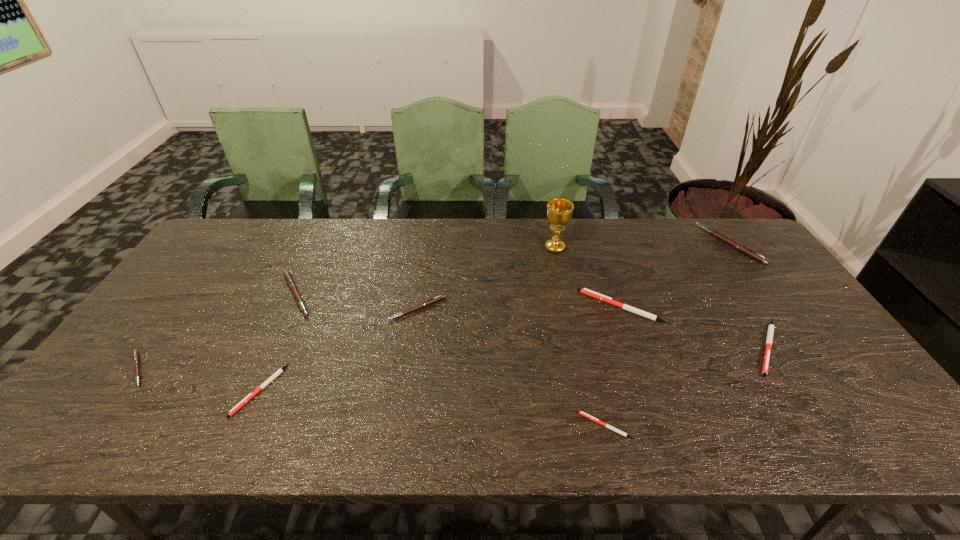
In order to click on vacant space that is in between the farthest pen and the smallest white pen in this screenshot , I will do `click(667, 335)`.

In order to click on unoccupied area between the smallest white pen and the chalice in this screenshot , I will do `click(580, 337)`.

The image size is (960, 540). Identify the location of blank region between the third smallest pink pen and the rightmost pink pen. (513, 270).

In order to click on empty space between the second smallest white pen and the second pink pen from left to right in this screenshot , I will do `click(278, 342)`.

Find the location of a particular element. blank region between the second biggest white pen and the smallest pink pen is located at coordinates (452, 359).

I want to click on free space between the third pink pen from right to left and the third biggest white pen, so click(278, 342).

Where is `vacant area between the third pink pen from left to right and the rightmost white pen`? The height and width of the screenshot is (540, 960). vacant area between the third pink pen from left to right and the rightmost white pen is located at coordinates (592, 328).

At what (x,y) coordinates should I click in order to perform the action: click on vacant space in between the third pink pen from right to left and the shortest pen. Please return your answer as a coordinate pair (x, y). Looking at the image, I should click on (450, 360).

Select which object is the seventh closest to the third smallest pink pen. Please provide its 2D coordinates. Your answer should be formatted as a tuple, i.e. [(x, y)], where the tuple contains the x and y coordinates of a point satisfying the conditions above.

[(771, 327)]

Point out which object is positioned as the fourth nearest to the third biggest white pen. Please provide its 2D coordinates. Your answer should be formatted as a tuple, i.e. [(x, y)], where the tuple contains the x and y coordinates of a point satisfying the conditions above.

[(594, 419)]